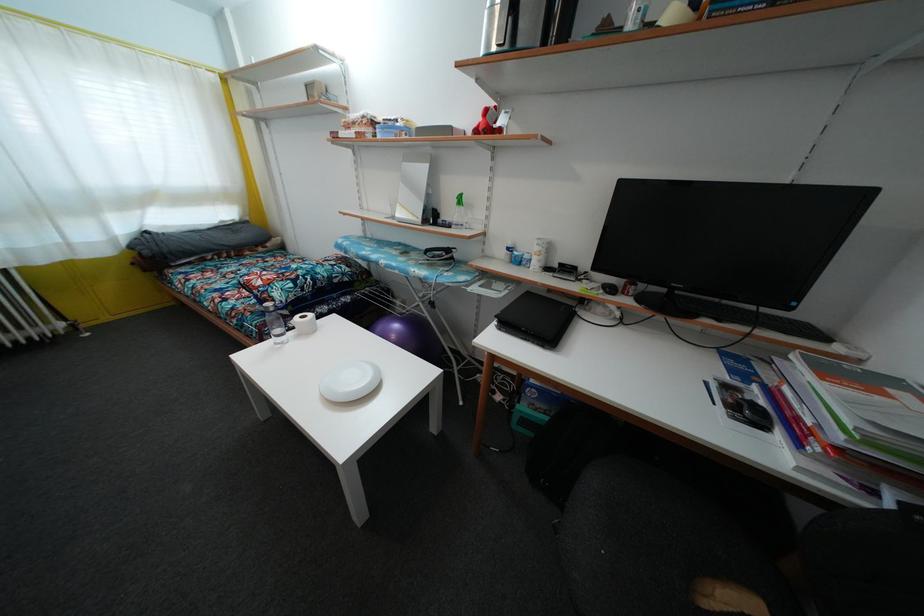
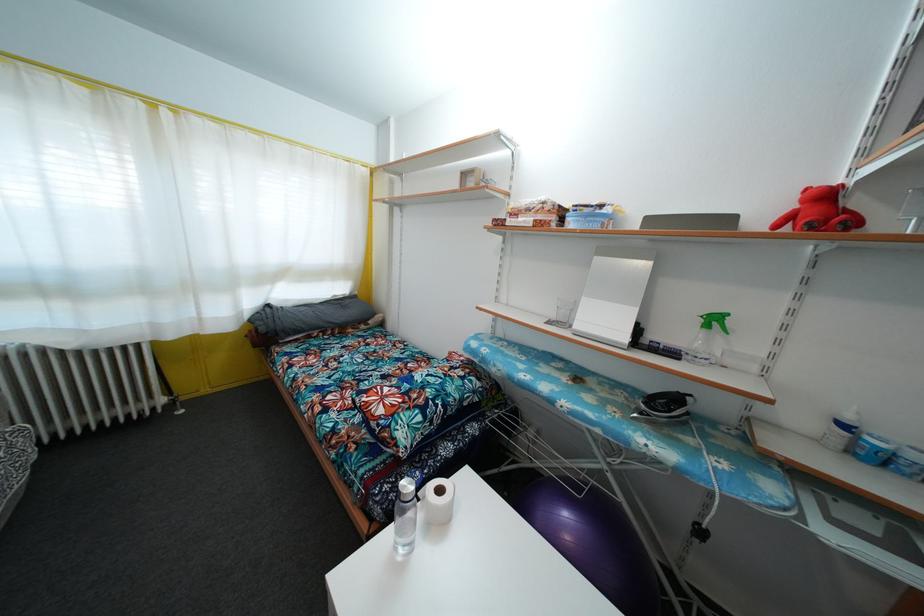
Where in the second image is the point corresponding to [251,225] from the first image?

(359, 300)